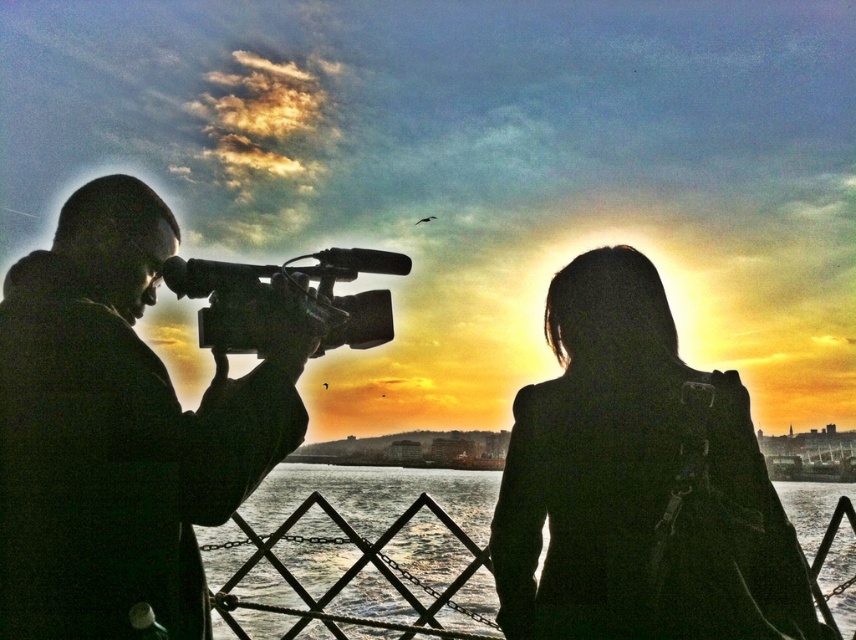
Based on the photo, you are a photographer trying to capture the sunset. You have two cameras available in the scene. Which camera is positioned closer to you, the silhouette camera at left or the black plastic video camera at left?

The silhouette camera at left is closer to the viewer than the black plastic video camera at left, so you should use the silhouette camera at left for better accessibility.

You are standing in the scene and want to place a small flag at the point that is closer to the camera. Which point should you choose between point (113,564) and point (676,566)?

Point (113,564) is in front of point (676,566), so you should place the flag at point (113,564).